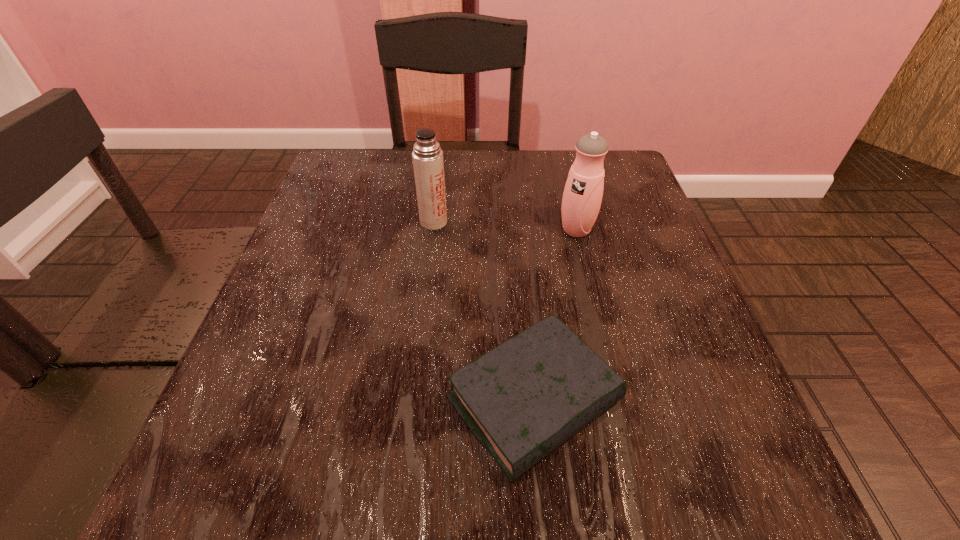
Identify the location of vacant space at the near edge of the desktop. Image resolution: width=960 pixels, height=540 pixels. (498, 476).

In the image, there is a desktop. Where is `vacant space at the left edge`? This screenshot has width=960, height=540. vacant space at the left edge is located at coordinates (358, 239).

Where is `vacant space at the right edge`? The width and height of the screenshot is (960, 540). vacant space at the right edge is located at coordinates click(678, 288).

At what (x,y) coordinates should I click in order to perform the action: click on blank space at the far left corner. Please return your answer as a coordinate pair (x, y). The width and height of the screenshot is (960, 540). Looking at the image, I should click on (330, 193).

The height and width of the screenshot is (540, 960). What are the coordinates of `vacant region at the far right corner of the desktop` in the screenshot? It's located at (642, 189).

Identify the location of vacant region at the near right corner of the desktop. (x=733, y=449).

Find the location of a particular element. unoccupied position between the leftmost object and the right thermos bottle is located at coordinates (505, 226).

Find the location of a particular element. free space between the left thermos bottle and the shortest object is located at coordinates (484, 312).

Identify the location of free space between the right thermos bottle and the leftmost object. (505, 226).

Find the location of a particular element. empty space between the leftmost object and the nearest object is located at coordinates (484, 312).